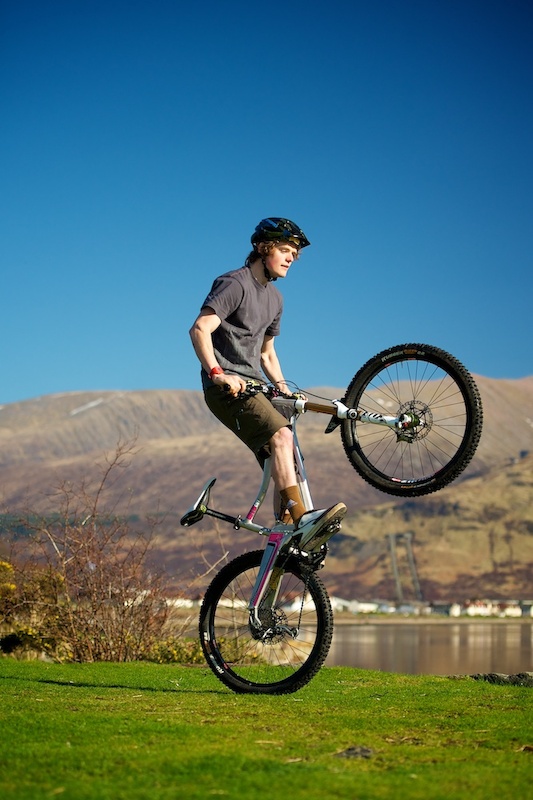
The width and height of the screenshot is (533, 800). Identify the location of frame. (269, 486).